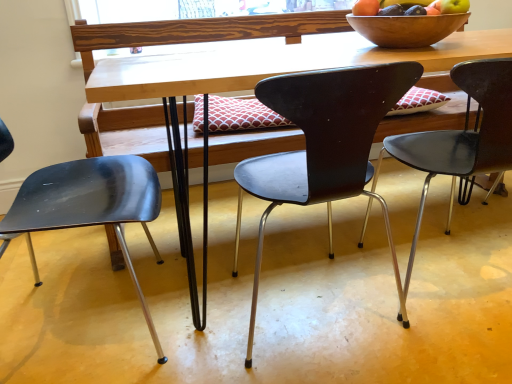
Identify the location of wooden bowl at upper right. This screenshot has width=512, height=384. (406, 29).

Can we say metallic black chair at left, arranged as the first chair when viewed from the left, lies outside matte black chair at center, marked as the 2th chair in a right-to-left arrangement?

Absolutely, metallic black chair at left, arranged as the first chair when viewed from the left, is external to matte black chair at center, marked as the 2th chair in a right-to-left arrangement.

Can you confirm if metallic black chair at left, arranged as the first chair when viewed from the left, is wider than matte black chair at center, marked as the 2th chair in a right-to-left arrangement?

Correct, the width of metallic black chair at left, arranged as the first chair when viewed from the left, exceeds that of matte black chair at center, marked as the 2th chair in a right-to-left arrangement.

Who is taller, metallic black chair at left, the 3th chair positioned from the right, or matte black chair at center, marked as the 2th chair in a right-to-left arrangement?

matte black chair at center, marked as the 2th chair in a right-to-left arrangement.

Who is shorter, wooden desk at center or metallic black chair at left, the 3th chair positioned from the right?

metallic black chair at left, the 3th chair positioned from the right, is shorter.

Which is more to the right, wooden desk at center or metallic black chair at left, arranged as the first chair when viewed from the left?

From the viewer's perspective, wooden desk at center appears more on the right side.

Is wooden desk at center placed right next to metallic black chair at left, arranged as the first chair when viewed from the left?

No, wooden desk at center is not making contact with metallic black chair at left, arranged as the first chair when viewed from the left.

Looking at their sizes, would you say matte black chair at center, marked as the 2th chair in a right-to-left arrangement, is wider or thinner than wooden bowl at upper right?

Clearly, matte black chair at center, marked as the 2th chair in a right-to-left arrangement, has more width compared to wooden bowl at upper right.

Is matte black chair at center, marked as the 2th chair in a right-to-left arrangement, positioned behind wooden bowl at upper right?

No, matte black chair at center, marked as the 2th chair in a right-to-left arrangement, is closer to the viewer.

From the image's perspective, is matte black chair at center, marked as the 2th chair in a right-to-left arrangement, over wooden bowl at upper right?

Actually, matte black chair at center, marked as the 2th chair in a right-to-left arrangement, appears below wooden bowl at upper right in the image.

Based on their positions, is matte black chair at center, marked as the 2th chair in a right-to-left arrangement, located to the left or right of wooden bowl at upper right?

In the image, matte black chair at center, marked as the 2th chair in a right-to-left arrangement, appears on the left side of wooden bowl at upper right.

This screenshot has width=512, height=384. I want to click on bowl above the matte black chair at center, arranged as the first chair when viewed from the right (from the image's perspective), so click(406, 29).

Is wooden bowl at upper right smaller than matte black chair at center, arranged as the first chair when viewed from the right?

Yes.

Do you think wooden bowl at upper right is within matte black chair at center, arranged as the 3th chair when viewed from the left, or outside of it?

wooden bowl at upper right cannot be found inside matte black chair at center, arranged as the 3th chair when viewed from the left.

Does wooden bowl at upper right have a lesser width compared to matte black chair at center, marked as the 2th chair in a right-to-left arrangement?

Yes, wooden bowl at upper right is thinner than matte black chair at center, marked as the 2th chair in a right-to-left arrangement.

Does point (433, 32) lie in front of point (386, 91)?

No, (433, 32) is further to viewer.

Is wooden bowl at upper right facing towards matte black chair at center, marked as the 2th chair in a right-to-left arrangement?

No, wooden bowl at upper right does not turn towards matte black chair at center, marked as the 2th chair in a right-to-left arrangement.

Would you say wooden desk at center is a long distance from matte black chair at center, marked as the 2th chair in a right-to-left arrangement?

No, there isn't a large distance between wooden desk at center and matte black chair at center, marked as the 2th chair in a right-to-left arrangement.

Between point (179, 40) and point (291, 116), which one is positioned in front?

Point (291, 116)

Is wooden desk at center positioned before matte black chair at center, the 2th chair positioned from the left?

No.

Locate an element on the screen. the 2nd chair in front of the matte black chair at center, arranged as the 3th chair when viewed from the left is located at coordinates (90, 206).

Does point (66, 167) appear closer or farther from the camera than point (422, 132)?

Point (66, 167) appears to be farther away from the viewer than point (422, 132).

Would you say metallic black chair at left, arranged as the first chair when viewed from the left, is to the left or to the right of matte black chair at center, arranged as the first chair when viewed from the right, in the picture?

Based on their positions, metallic black chair at left, arranged as the first chair when viewed from the left, is located to the left of matte black chair at center, arranged as the first chair when viewed from the right.

From a real-world perspective, between metallic black chair at left, arranged as the first chair when viewed from the left, and matte black chair at center, arranged as the 3th chair when viewed from the left, who is vertically higher?

matte black chair at center, arranged as the 3th chair when viewed from the left.

Where is `the 1st chair above when counting from the metallic black chair at left, arranged as the first chair when viewed from the left (from the image's perspective)`? This screenshot has height=384, width=512. the 1st chair above when counting from the metallic black chair at left, arranged as the first chair when viewed from the left (from the image's perspective) is located at coordinates (323, 147).

The width and height of the screenshot is (512, 384). Find the location of `the 2nd chair in front of the wooden desk at center, counting from the anchor's position`. the 2nd chair in front of the wooden desk at center, counting from the anchor's position is located at coordinates (90, 206).

Estimate the real-world distances between objects in this image. Which object is closer to matte black chair at center, the 2th chair positioned from the left, wooden bowl at upper right or metallic black chair at left, the 3th chair positioned from the right?

wooden bowl at upper right is positioned closer to the anchor matte black chair at center, the 2th chair positioned from the left.

From the picture: Considering their positions, is matte black chair at center, arranged as the 3th chair when viewed from the left, positioned further to wooden bowl at upper right than wooden desk at center?

Based on the image, matte black chair at center, arranged as the 3th chair when viewed from the left, appears to be further to wooden bowl at upper right.

Looking at the image, which one is located further to wooden desk at center, matte black chair at center, arranged as the 3th chair when viewed from the left, or wooden bowl at upper right?

Among the two, matte black chair at center, arranged as the 3th chair when viewed from the left, is located further to wooden desk at center.

In the scene shown: When comparing their distances from matte black chair at center, arranged as the first chair when viewed from the right, does wooden desk at center or metallic black chair at left, the 3th chair positioned from the right, seem further?

Based on the image, metallic black chair at left, the 3th chair positioned from the right, appears to be further to matte black chair at center, arranged as the first chair when viewed from the right.

Looking at the image, which one is located further to matte black chair at center, arranged as the 3th chair when viewed from the left, metallic black chair at left, arranged as the first chair when viewed from the left, or wooden desk at center?

Among the two, metallic black chair at left, arranged as the first chair when viewed from the left, is located further to matte black chair at center, arranged as the 3th chair when viewed from the left.

Which object lies further to the anchor point wooden desk at center, wooden bowl at upper right or metallic black chair at left, the 3th chair positioned from the right?

Among the two, metallic black chair at left, the 3th chair positioned from the right, is located further to wooden desk at center.

Which object lies nearer to the anchor point wooden desk at center, metallic black chair at left, the 3th chair positioned from the right, or matte black chair at center, marked as the 2th chair in a right-to-left arrangement?

Among the two, matte black chair at center, marked as the 2th chair in a right-to-left arrangement, is located nearer to wooden desk at center.

Based on their spatial positions, is matte black chair at center, arranged as the 3th chair when viewed from the left, or wooden desk at center further from metallic black chair at left, arranged as the first chair when viewed from the left?

matte black chair at center, arranged as the 3th chair when viewed from the left, is positioned further to the anchor metallic black chair at left, arranged as the first chair when viewed from the left.

Identify the location of desk located between matte black chair at center, the 2th chair positioned from the left, and matte black chair at center, arranged as the 3th chair when viewed from the left, in the left-right direction. (237, 79).

Identify the location of chair between wooden bowl at upper right and matte black chair at center, marked as the 2th chair in a right-to-left arrangement, vertically. Image resolution: width=512 pixels, height=384 pixels. (463, 137).

Locate an element on the screen. Image resolution: width=512 pixels, height=384 pixels. desk between metallic black chair at left, arranged as the first chair when viewed from the left, and matte black chair at center, arranged as the first chair when viewed from the right, in the horizontal direction is located at coordinates (237, 79).

You are a GUI agent. You are given a task and a screenshot of the screen. Output one action in this format:
    pyautogui.click(x=<x>, y=<y>)
    Task: Click on the bowl located between metallic black chair at left, arranged as the first chair when viewed from the left, and matte black chair at center, arranged as the first chair when viewed from the right, in the left-right direction
    
    Given the screenshot: What is the action you would take?
    pyautogui.click(x=406, y=29)